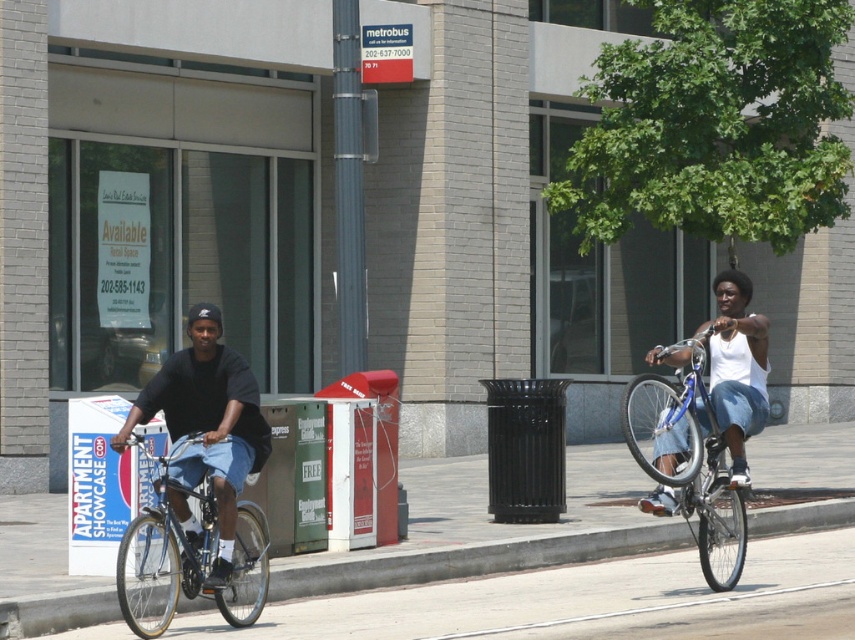
You are a delivery person trying to park your silver metallic bicycle at left near the gray concrete curb at lower left. Can you park the bicycle so that it fits entirely within the width of the curb?

The gray concrete curb at lower left is thinner than the silver metallic bicycle at left, so the bicycle will not fit entirely within the width of the curb.

You are a delivery person who needs to park your bike near the gray concrete curb at lower left. Given that the curb is at coordinates point 0.875, 0.551, can you estimate its location relative to the other objects in the scene?

The gray concrete curb at lower left is located at coordinates point [470,560], which places it near the lower left portion of the image.

You are a delivery person trying to navigate through the sidewalk. You see a person wearing a matte black shirt at left and a silver metallic bicycle at left. Which object is wider?

The matte black shirt at left is wider than the silver metallic bicycle at left according to the description.